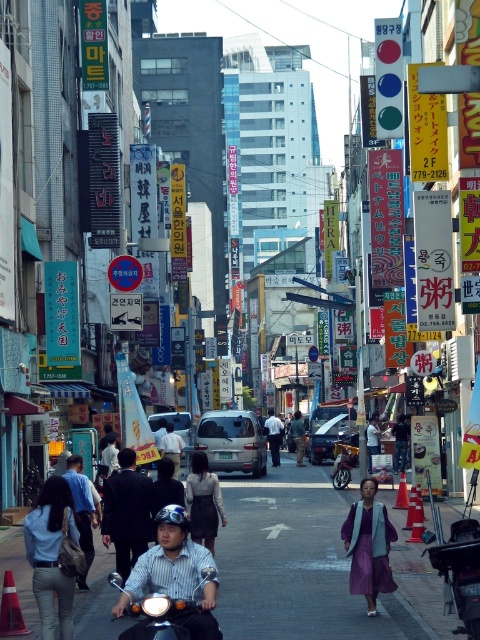
Question: Can you confirm if matte black helmet at center is positioned to the right of dark suit at center?

Choices:
 (A) yes
 (B) no

Answer: (A)

Question: Which of the following is the closest to the observer?

Choices:
 (A) (397, 460)
 (B) (367, 442)

Answer: (A)

Question: Among these points, which one is farthest from the camera?

Choices:
 (A) (300, 456)
 (B) (376, 426)
 (C) (204, 522)
 (D) (54, 618)

Answer: (A)

Question: Which point is closer to the camera taking this photo?

Choices:
 (A) (83, 545)
 (B) (206, 484)
 (C) (60, 492)
 (D) (168, 525)

Answer: (D)

Question: Does dark suit at center lie in front of light blue shirt at center?

Choices:
 (A) no
 (B) yes

Answer: (B)

Question: Can you confirm if denim jacket at lower left is positioned to the right of dark blue shirt at center?

Choices:
 (A) no
 (B) yes

Answer: (B)